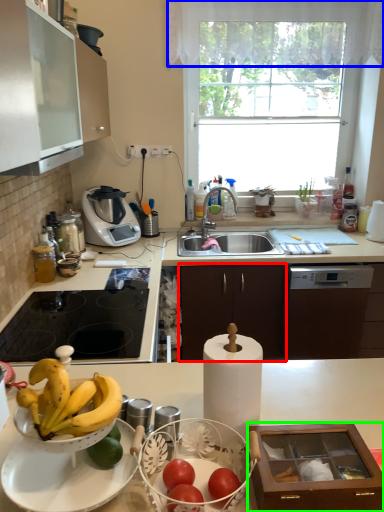
Question: Estimate the real-world distances between objects in this image. Which object is farther from cabinetry (highlighted by a red box), curtain (highlighted by a blue box) or cabinetry (highlighted by a green box)?

Choices:
 (A) curtain
 (B) cabinetry

Answer: (B)